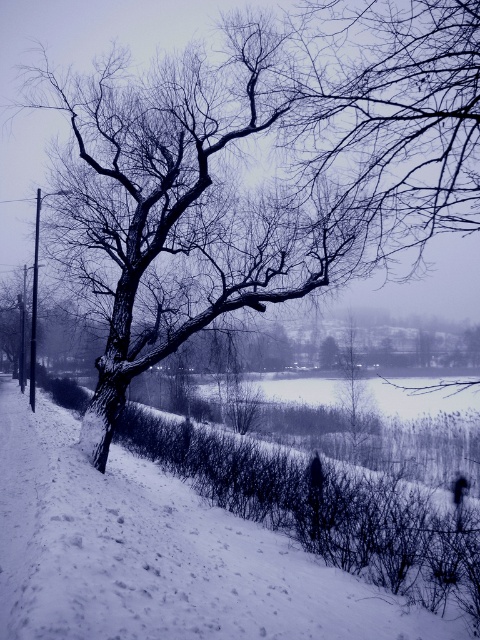
Question: Can you confirm if bare wood tree at center is positioned to the right of white fluffy snow at center?

Choices:
 (A) yes
 (B) no

Answer: (A)

Question: Which of the following is the closest to the observer?

Choices:
 (A) (442, 636)
 (B) (372, 150)

Answer: (A)

Question: Can you confirm if bare wood tree at center is positioned above white fluffy snow at center?

Choices:
 (A) no
 (B) yes

Answer: (B)

Question: Which point is closer to the camera taking this photo?

Choices:
 (A) (143, 552)
 (B) (131, 227)

Answer: (A)

Question: In this image, where is bare wood tree at center located relative to white fluffy snow at center?

Choices:
 (A) below
 (B) above

Answer: (B)